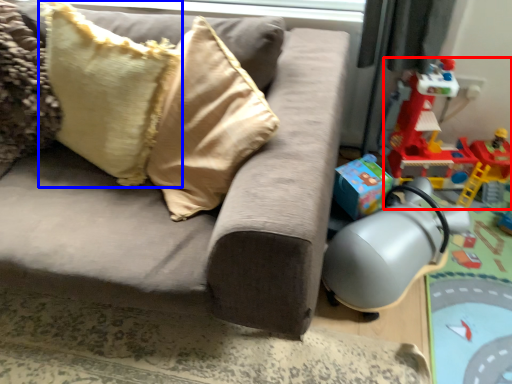
Question: Which of the following is the farthest to the observer, toy (highlighted by a red box) or pillow (highlighted by a blue box)?

Choices:
 (A) toy
 (B) pillow

Answer: (A)